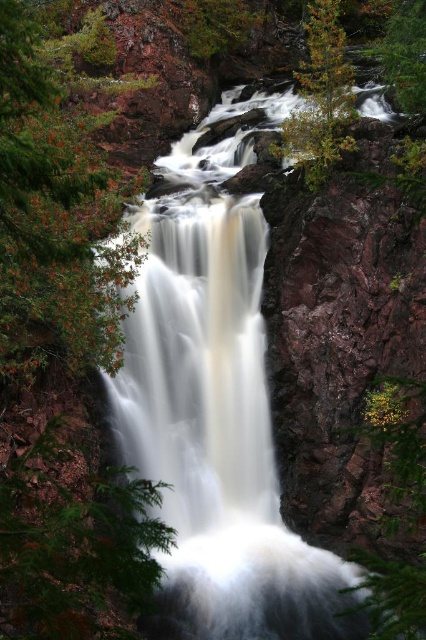
Question: Can you confirm if brown rough rock at center is bigger than green matte tree at upper right?

Choices:
 (A) yes
 (B) no

Answer: (A)

Question: Which point is farther from the camera taking this photo?

Choices:
 (A) (267, 529)
 (B) (290, 150)

Answer: (B)

Question: Does green matte tree at left have a lesser width compared to green matte tree at upper right?

Choices:
 (A) no
 (B) yes

Answer: (A)

Question: Does brown rough rock at center appear over green matte tree at upper right?

Choices:
 (A) yes
 (B) no

Answer: (B)

Question: Which of the following is the farthest from the observer?

Choices:
 (A) green matte tree at left
 (B) green matte tree at upper right
 (C) brown rough rock at center

Answer: (B)

Question: Which of the following is the farthest from the observer?

Choices:
 (A) green matte tree at upper right
 (B) brown rough rock at center

Answer: (A)